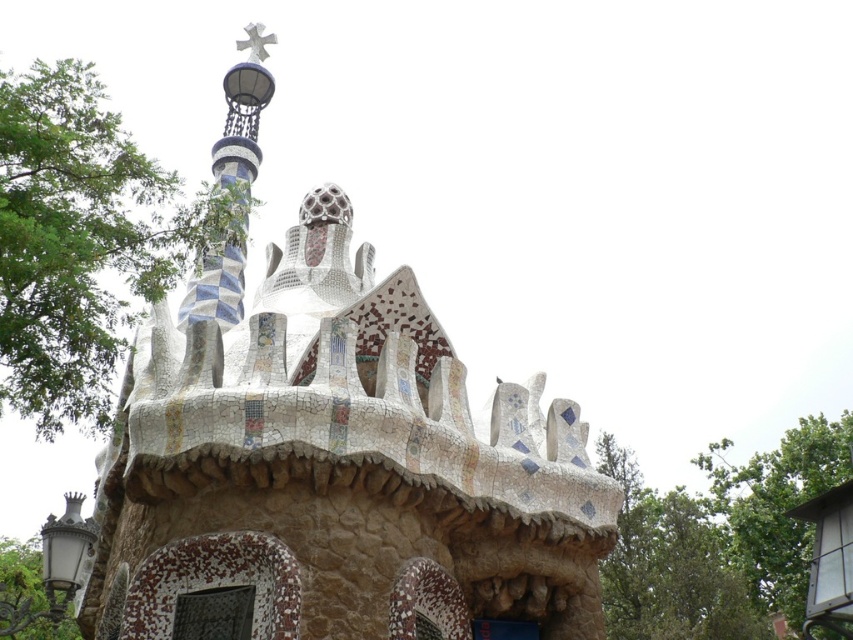
Does point (155, 579) come in front of point (213, 300)?

Yes, it is in front of point (213, 300).

You are a GUI agent. You are given a task and a screenshot of the screen. Output one action in this format:
    pyautogui.click(x=<x>, y=<y>)
    Task: Click on the mosaic stone chapel at center
    The height and width of the screenshot is (640, 853).
    Given the screenshot: What is the action you would take?
    pyautogui.click(x=334, y=468)